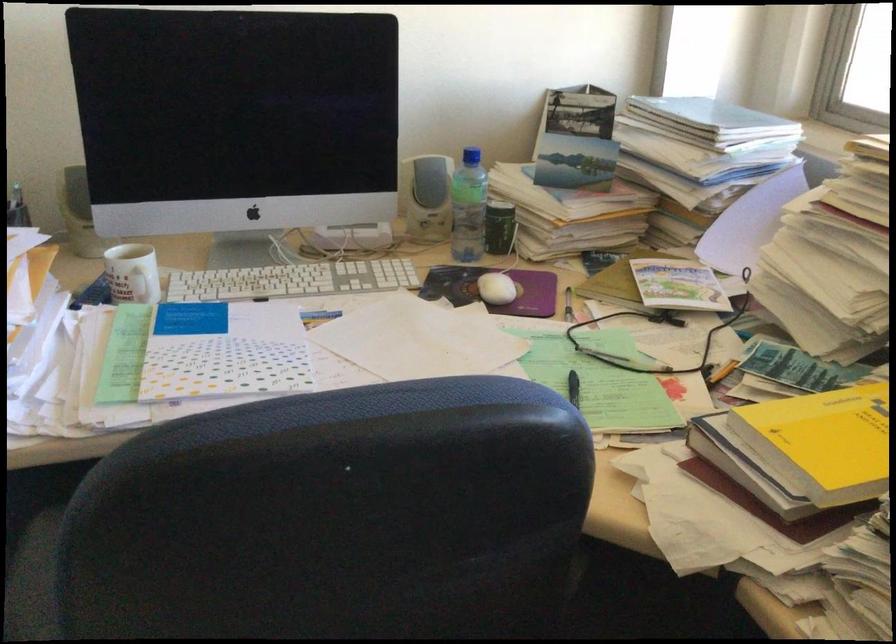
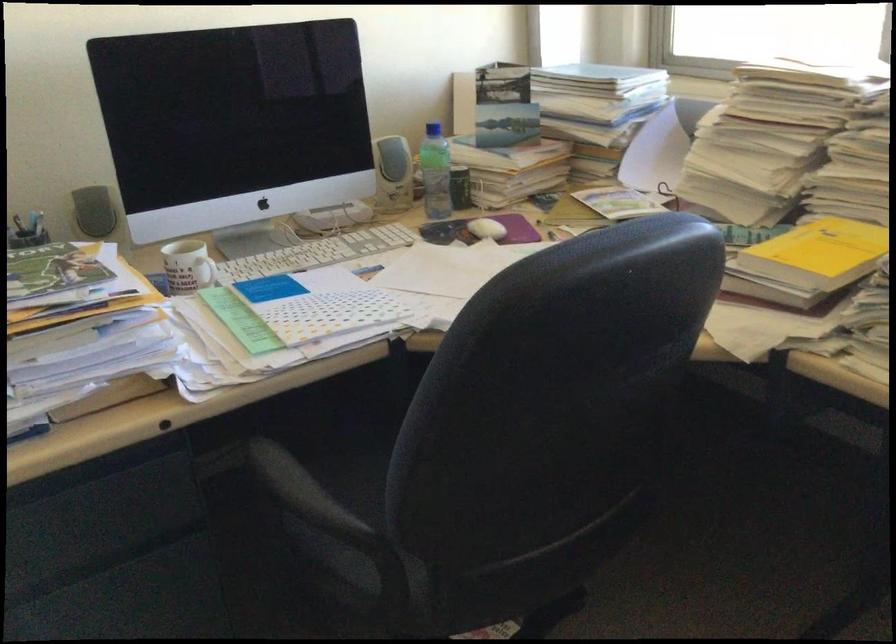
Find the pixel in the second image that matches the point at 492,290 in the first image.

(487, 229)